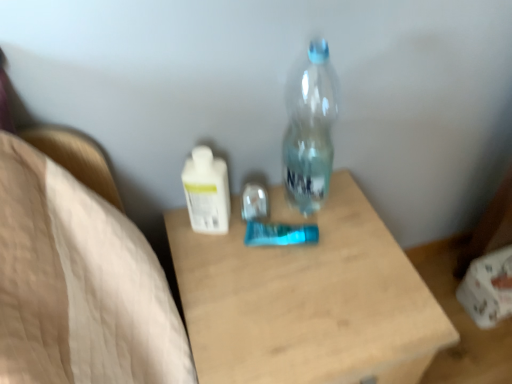
You are a GUI agent. You are given a task and a screenshot of the screen. Output one action in this format:
    pyautogui.click(x=<x>, y=<y>)
    Task: Click on the empty space that is ontop of wooden table at center (from a real-world perspective)
    The height and width of the screenshot is (384, 512).
    Given the screenshot: What is the action you would take?
    pyautogui.click(x=298, y=276)